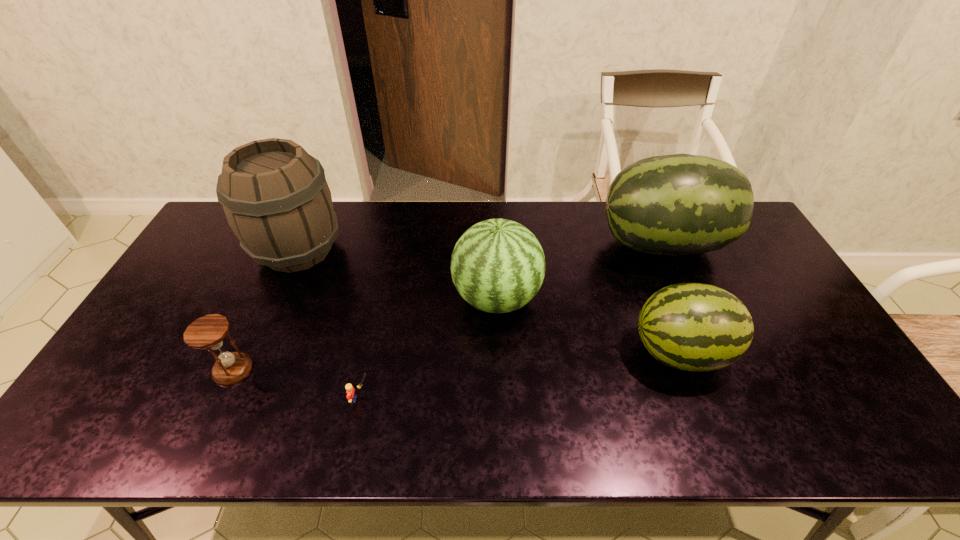
The height and width of the screenshot is (540, 960). What are the coordinates of `wine bucket` in the screenshot? It's located at (276, 199).

The image size is (960, 540). Identify the location of the third object from right to left. (498, 266).

Image resolution: width=960 pixels, height=540 pixels. Identify the location of the shortest watermelon. (696, 327).

Locate an element on the screen. hourglass is located at coordinates (207, 332).

Where is `Lego`? Image resolution: width=960 pixels, height=540 pixels. Lego is located at coordinates (351, 396).

This screenshot has height=540, width=960. Identify the location of the shortest object. (351, 396).

Locate an element on the screen. The width and height of the screenshot is (960, 540). free spot located on the front of the wine bucket is located at coordinates (233, 399).

Identify the location of free space located on the front of the leftmost watermelon. The image size is (960, 540). (502, 443).

Identify the location of vacant space located 0.300m at the stem end of the shortest watermelon. The width and height of the screenshot is (960, 540). (516, 352).

Locate an element on the screen. This screenshot has height=540, width=960. free space located at the stem end of the shortest watermelon is located at coordinates [x=516, y=352].